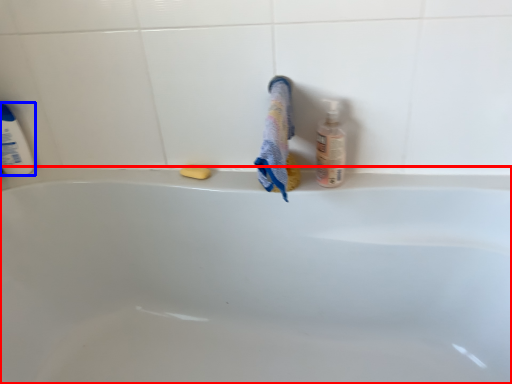
Question: Which object appears farthest to the camera in this image, bathtub (highlighted by a red box) or cleaning product (highlighted by a blue box)?

Choices:
 (A) bathtub
 (B) cleaning product

Answer: (B)